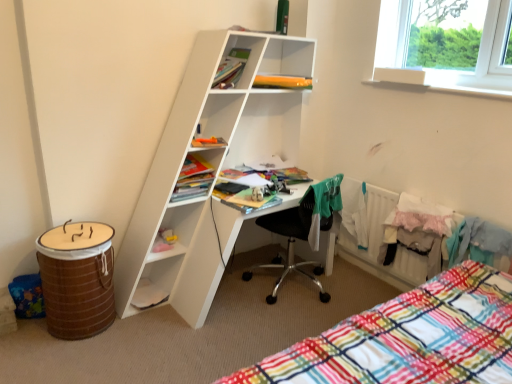
Question: Considering the positions of orange plastic bag at upper center, arranged as the second book when viewed from the top, and white matte desk at center in the image, is orange plastic bag at upper center, arranged as the second book when viewed from the top, wider or thinner than white matte desk at center?

Choices:
 (A) wide
 (B) thin

Answer: (B)

Question: From a real-world perspective, relative to white matte desk at center, is orange plastic bag at upper center, arranged as the second book when viewed from the top, vertically above or below?

Choices:
 (A) below
 (B) above

Answer: (B)

Question: Based on their relative distances, which object is farther from the green fabric shirt at center?

Choices:
 (A) matte yellow book at center, which appears as the 2th book when ordered from the bottom
 (B) black mesh chair at center
 (C) orange plastic bag at upper center, which ranks as the 4th book in bottom-to-top order
 (D) orange matte book at center, the third book when ordered from bottom to top
 (E) brown woven barrel at lower left

Answer: (E)

Question: Considering the real-world distances, which object is closest to the orange matte book at center, which is the third book from top to bottom?

Choices:
 (A) brown woven barrel at lower left
 (B) black mesh chair at center
 (C) white matte desk at center
 (D) matte yellow book at center, arranged as the fourth book when viewed from the top
 (E) white plastic radiator at lower right

Answer: (D)